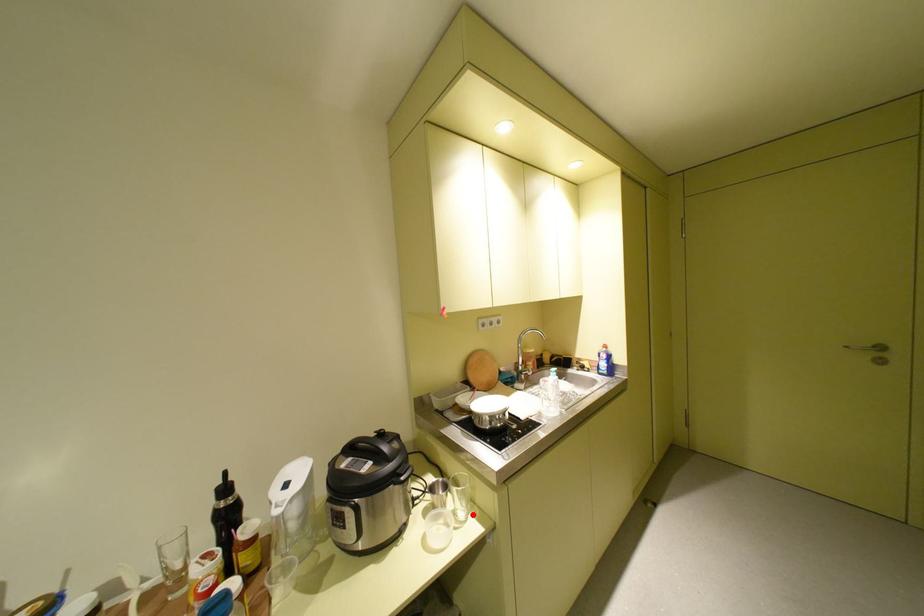
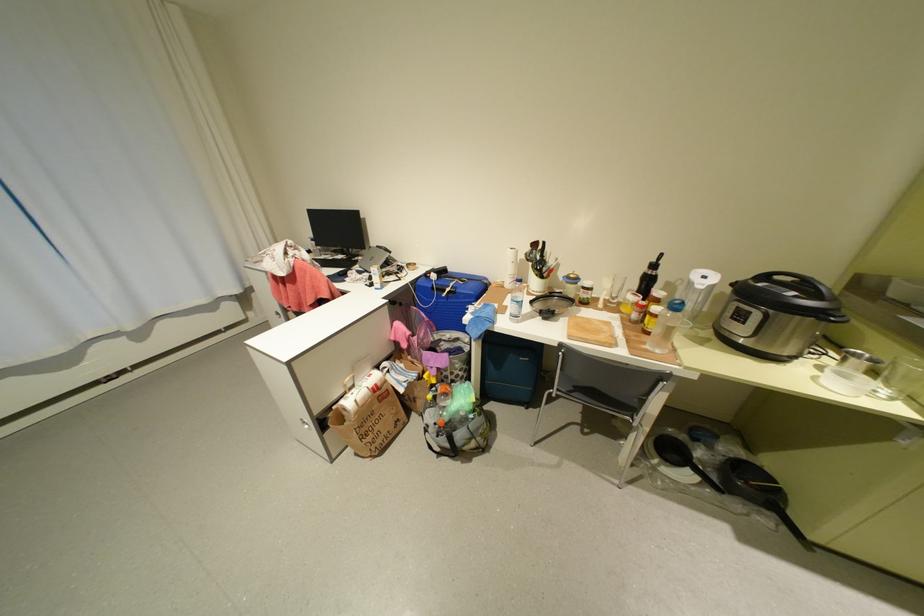
The point at the highlighted location is marked in the first image. Where is the corresponding point in the second image?

(897, 392)